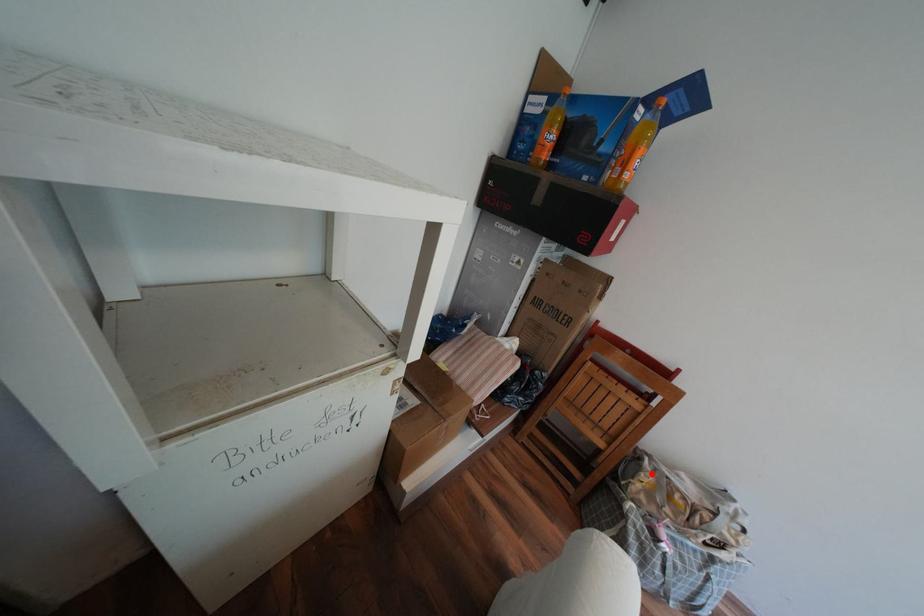
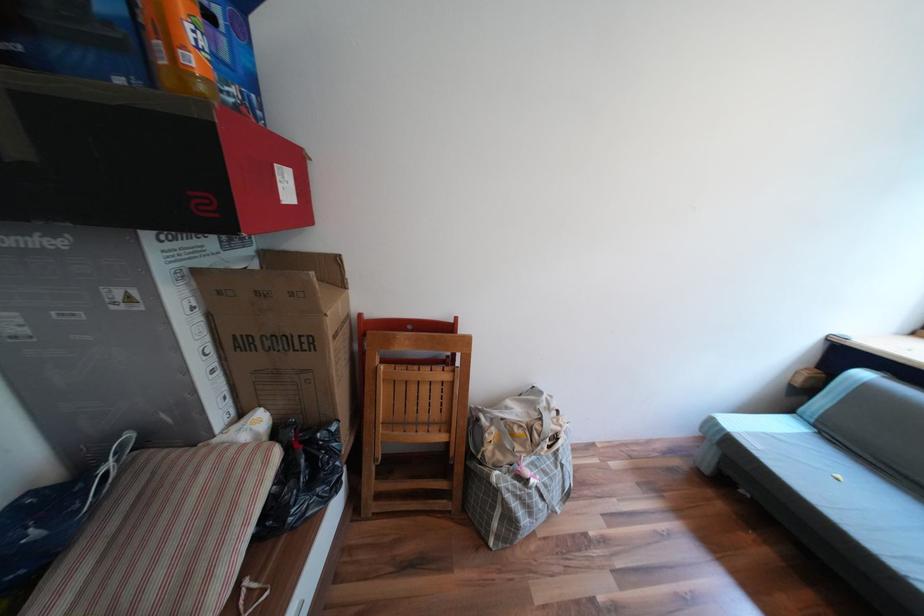
Where in the second image is the point corresponding to the highlighted location from the first image?

(495, 435)